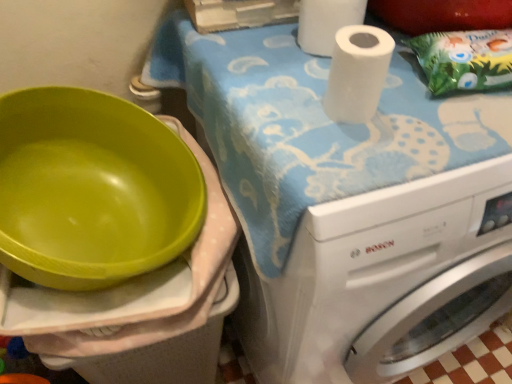
Identify the location of empty space that is ontop of white glossy washing machine at upper right. Image resolution: width=512 pixels, height=384 pixels. (342, 98).